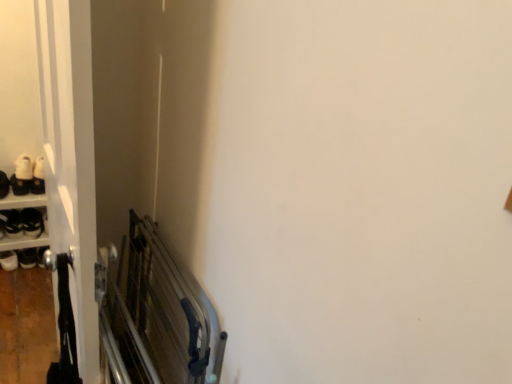
Question: Can you confirm if white matte shoe at left, which is the first footwear from bottom to top, is taller than white matte shoe at upper left, which appears as the first footwear when viewed from the top?

Choices:
 (A) no
 (B) yes

Answer: (B)

Question: Is white matte shoe at left, which is the first footwear from bottom to top, facing away from white matte shoe at upper left, the second footwear when ordered from bottom to top?

Choices:
 (A) yes
 (B) no

Answer: (B)

Question: Considering the relative positions of white matte shoe at left, which is the first footwear from bottom to top, and white matte shoe at upper left, which appears as the first footwear when viewed from the top, in the image provided, is white matte shoe at left, which is the first footwear from bottom to top, behind white matte shoe at upper left, which appears as the first footwear when viewed from the top,?

Choices:
 (A) no
 (B) yes

Answer: (A)

Question: Does white matte shoe at left, the second footwear in the top-to-bottom sequence, have a lesser height compared to white matte shoe at upper left, the second footwear when ordered from bottom to top?

Choices:
 (A) yes
 (B) no

Answer: (B)

Question: Considering the relative positions of white matte shoe at left, which is the first footwear from bottom to top, and white matte shoe at upper left, which appears as the first footwear when viewed from the top, in the image provided, is white matte shoe at left, which is the first footwear from bottom to top, to the left of white matte shoe at upper left, which appears as the first footwear when viewed from the top, from the viewer's perspective?

Choices:
 (A) no
 (B) yes

Answer: (B)

Question: Considering the positions of white glossy door at left and white matte shoe at upper left, which appears as the first footwear when viewed from the top, in the image, is white glossy door at left wider or thinner than white matte shoe at upper left, which appears as the first footwear when viewed from the top,?

Choices:
 (A) thin
 (B) wide

Answer: (A)

Question: Is white glossy door at left bigger or smaller than white matte shoe at upper left, which appears as the first footwear when viewed from the top?

Choices:
 (A) big
 (B) small

Answer: (A)

Question: Based on their positions, is white glossy door at left located to the left or right of white matte shoe at upper left, the second footwear when ordered from bottom to top?

Choices:
 (A) left
 (B) right

Answer: (B)

Question: Choose the correct answer: Is white glossy door at left inside white matte shoe at upper left, the second footwear when ordered from bottom to top, or outside it?

Choices:
 (A) outside
 (B) inside

Answer: (A)

Question: Considering the positions of white matte shoe at upper left, the second footwear when ordered from bottom to top, and white glossy door at left in the image, is white matte shoe at upper left, the second footwear when ordered from bottom to top, wider or thinner than white glossy door at left?

Choices:
 (A) thin
 (B) wide

Answer: (B)

Question: From the image's perspective, is white matte shoe at upper left, which appears as the first footwear when viewed from the top, located above or below white glossy door at left?

Choices:
 (A) above
 (B) below

Answer: (A)

Question: Is white matte shoe at upper left, which appears as the first footwear when viewed from the top, situated inside white glossy door at left or outside?

Choices:
 (A) inside
 (B) outside

Answer: (B)

Question: Considering their positions, is white matte shoe at upper left, the second footwear when ordered from bottom to top, located in front of or behind white glossy door at left?

Choices:
 (A) front
 (B) behind

Answer: (B)

Question: Considering their positions, is white matte shoe at upper left, the second footwear when ordered from bottom to top, located in front of or behind white matte shoe at left, the second footwear in the top-to-bottom sequence?

Choices:
 (A) behind
 (B) front

Answer: (A)

Question: From a real-world perspective, is white matte shoe at upper left, which appears as the first footwear when viewed from the top, above or below white matte shoe at left, the second footwear in the top-to-bottom sequence?

Choices:
 (A) below
 (B) above

Answer: (B)